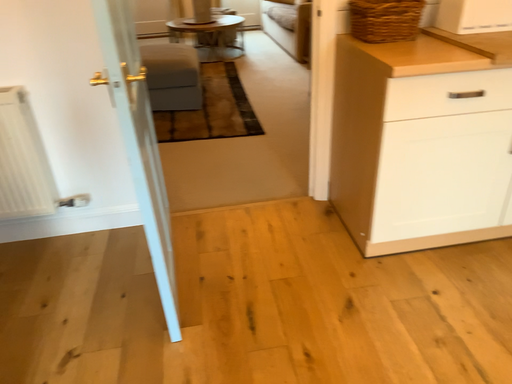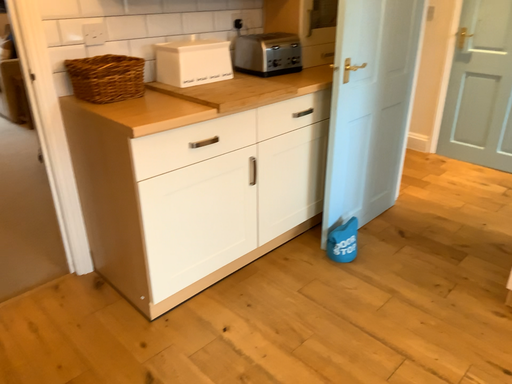
Question: How did the camera likely rotate when shooting the video?

Choices:
 (A) rotated left
 (B) rotated right

Answer: (B)